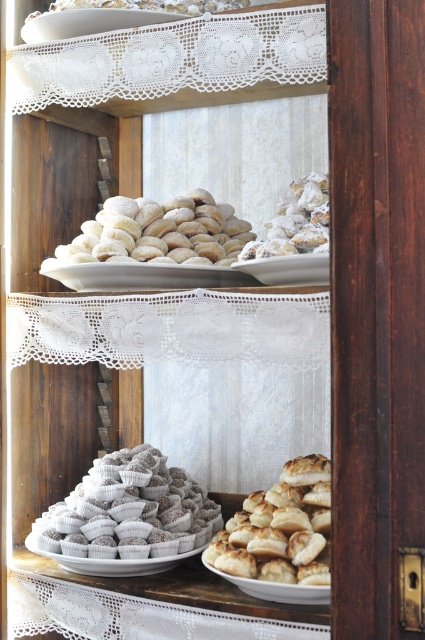
You are a baker who wants to place a new batch of pastries in the cabinet. You have a tray of pastries that are 10 cm wide. The golden brown flaky pastry at lower center and the white powdered sugar cookies at upper center are already in the cabinet. Which existing pastry can the new tray fit next to without overlapping?

The golden brown flaky pastry at lower center has a smaller width than the white powdered sugar cookies at upper center. Since the new tray is 10 cm wide, it can fit next to the golden brown flaky pastry at lower center if its width is less than 10 cm. However, without knowing the exact width of the existing pastries, it is impossible to determine definitively.

You are standing in front of the wooden cabinet with glass doors and notice two points marked on the cabinet. The first point is at coordinates point (231, 253) and the second point is at point (214, 1). Which of these two points is closer to your current position?

Point (231, 253) is closer to the camera than point (214, 1), so the first point is closer to your current position.

You are a baker who wants to display a new batch of cookies. You have two options in the cabinet. Which one is taller between the powdery white cookies at center and the white powdered sugar cookies at upper center?

The powdery white cookies at center are much taller than the white powdered sugar cookies at upper center.